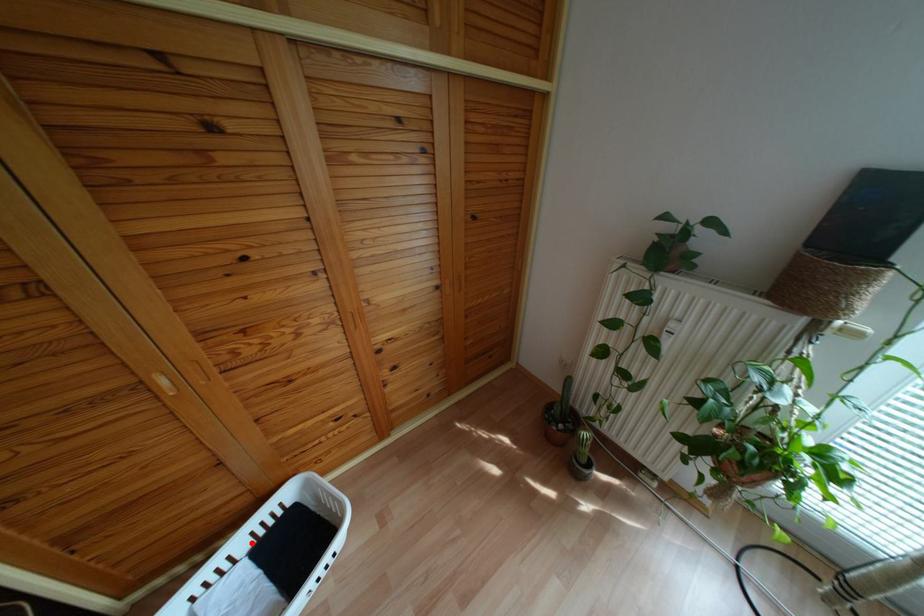
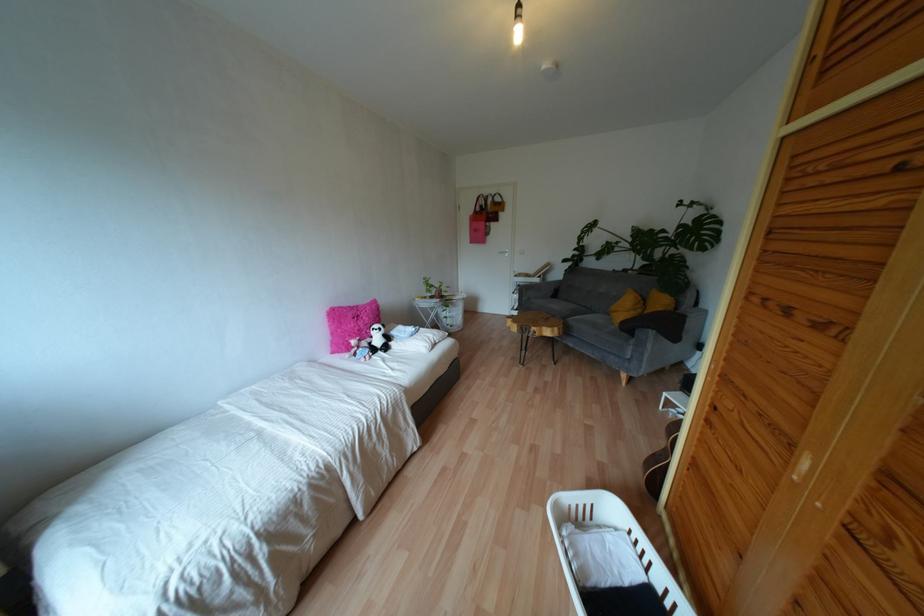
In the second image, find the point that corresponds to the highlighted location in the first image.

(660, 592)